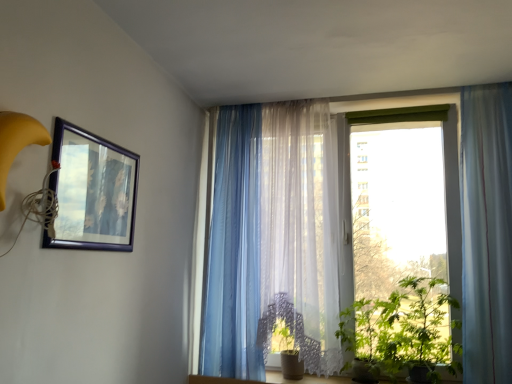
What do you see at coordinates (402, 330) in the screenshot?
I see `green leafy plant at right` at bounding box center [402, 330].

Describe the element at coordinates (279, 239) in the screenshot. I see `translucent fabric curtain at center, the second curtain viewed from the right` at that location.

What is the approximate width of matte black picture frame at upper left?

matte black picture frame at upper left is 2.11 inches in width.

You are a GUI agent. You are given a task and a screenshot of the screen. Output one action in this format:
    pyautogui.click(x=<x>, y=<y>)
    Task: Click on the translucent blue curtain at center, arranged as the third curtain when viewed from the right
    The height and width of the screenshot is (384, 512).
    Given the screenshot: What is the action you would take?
    pyautogui.click(x=234, y=250)

Considering the positions of point (245, 123) and point (376, 324), is point (245, 123) closer or farther from the camera than point (376, 324)?

Point (245, 123).

In terms of size, does translucent blue curtain at center, which is counted as the 1th curtain, starting from the left, appear bigger or smaller than green leafy plant at right?

In the image, translucent blue curtain at center, which is counted as the 1th curtain, starting from the left, appears to be larger than green leafy plant at right.

Is translucent blue curtain at center, arranged as the third curtain when viewed from the right, not close to green leafy plant at right?

translucent blue curtain at center, arranged as the third curtain when viewed from the right, is actually quite close to green leafy plant at right.

From a real-world perspective, between translucent blue curtain at center, arranged as the third curtain when viewed from the right, and green leafy plant at right, who is vertically lower?

In real-world perspective, green leafy plant at right is lower.

Is translucent fabric curtain at center, the second curtain viewed from the right, aimed at translucent fabric at center?

Yes, translucent fabric curtain at center, the second curtain viewed from the right, is aimed at translucent fabric at center.

In the scene shown: Does translucent fabric curtain at center, the second curtain when ordered from left to right, contain translucent fabric at center?

Definitely not — translucent fabric at center is not inside translucent fabric curtain at center, the second curtain when ordered from left to right.

Is translucent fabric curtain at center, the second curtain viewed from the right, touching translucent fabric at center?

translucent fabric curtain at center, the second curtain viewed from the right, and translucent fabric at center are clearly separated.

Does translucent fabric curtain at center, the second curtain viewed from the right, come behind translucent fabric at center?

That is True.

From a real-world perspective, is green leafy plant at right on translucent fabric at center?

No, from a real-world perspective, green leafy plant at right is not above translucent fabric at center.

From the image's perspective, is green leafy plant at right located above or below translucent fabric at center?

Based on their image positions, green leafy plant at right is located beneath translucent fabric at center.

Is point (391, 373) positioned before point (497, 333)?

No, it is not.

Does green leafy plant at right have a greater width compared to translucent fabric at center?

Correct, the width of green leafy plant at right exceeds that of translucent fabric at center.

Does translucent fabric at center have a lesser width compared to translucent blue curtain at right, the 1th curtain in the right-to-left sequence?

No.

Is translucent fabric at center at the right side of translucent blue curtain at right, the 1th curtain in the right-to-left sequence?

No, translucent fabric at center is not to the right of translucent blue curtain at right, the 1th curtain in the right-to-left sequence.

From a real-world perspective, is translucent fabric at center located higher than translucent blue curtain at right, the 1th curtain in the right-to-left sequence?

Incorrect, from a real-world perspective, translucent fabric at center is lower than translucent blue curtain at right, the 1th curtain in the right-to-left sequence.

How different are the orientations of translucent fabric at center and translucent blue curtain at right, the 1th curtain in the right-to-left sequence, in degrees?

The facing directions of translucent fabric at center and translucent blue curtain at right, the 1th curtain in the right-to-left sequence, are 0.13 degrees apart.

From the image's perspective, is green leafy plant at right located beneath green leafy plant at lower right?

Incorrect, from the image's perspective, green leafy plant at right is higher than green leafy plant at lower right.

Is point (394, 356) closer or farther from the camera than point (341, 342)?

Point (394, 356) is positioned closer to the camera compared to point (341, 342).

Looking at the image, does green leafy plant at right seem bigger or smaller compared to green leafy plant at lower right?

In the image, green leafy plant at right appears to be larger than green leafy plant at lower right.

Between translucent fabric at center and translucent fabric curtain at center, the second curtain when ordered from left to right, which one has more height?

With more height is translucent fabric curtain at center, the second curtain when ordered from left to right.

From a real-world perspective, is translucent fabric at center positioned above or below translucent fabric curtain at center, the second curtain when ordered from left to right?

From a real-world perspective, translucent fabric at center is physically below translucent fabric curtain at center, the second curtain when ordered from left to right.

Is translucent fabric at center aimed at translucent fabric curtain at center, the second curtain when ordered from left to right?

Yes, translucent fabric at center is facing translucent fabric curtain at center, the second curtain when ordered from left to right.

Between translucent fabric at center and translucent fabric curtain at center, the second curtain viewed from the right, which one appears on the right side from the viewer's perspective?

translucent fabric at center.

Is translucent fabric at center bigger or smaller than green leafy plant at lower right?

Clearly, translucent fabric at center is larger in size than green leafy plant at lower right.

Which of these two, translucent fabric at center or green leafy plant at lower right, stands shorter?

Standing shorter between the two is green leafy plant at lower right.

Is there a large distance between translucent fabric at center and green leafy plant at lower right?

Actually, translucent fabric at center and green leafy plant at lower right are a little close together.

Measure the distance between translucent fabric at center and green leafy plant at lower right.

They are 16.18 inches apart.

From the green leafy plant at right, count 2nd curtains backward and point to it. Please provide its 2D coordinates.

[(234, 250)]

Locate an element on the screen. This screenshot has width=512, height=384. the 2nd curtain above when counting from the translucent fabric at center (from the image's perspective) is located at coordinates (279, 239).

Which object lies nearer to the anchor point translucent blue curtain at center, which is counted as the 1th curtain, starting from the left, matte black picture frame at upper left or translucent fabric at center?

translucent fabric at center lies closer to translucent blue curtain at center, which is counted as the 1th curtain, starting from the left, than the other object.

Estimate the real-world distances between objects in this image. Which object is closer to translucent blue curtain at right, the 1th curtain in the right-to-left sequence, translucent fabric curtain at center, the second curtain when ordered from left to right, or green leafy plant at right?

green leafy plant at right.

Consider the image. Considering their positions, is translucent fabric at center positioned further to green leafy plant at right than matte black picture frame at upper left?

matte black picture frame at upper left is further to green leafy plant at right.

Which object lies nearer to the anchor point translucent fabric at center, green leafy plant at right or matte black picture frame at upper left?

Among the two, green leafy plant at right is located nearer to translucent fabric at center.

When comparing their distances from translucent blue curtain at right, the third curtain when ordered from left to right, does green leafy plant at right or translucent blue curtain at center, which is counted as the 1th curtain, starting from the left, seem further?

translucent blue curtain at center, which is counted as the 1th curtain, starting from the left, lies further to translucent blue curtain at right, the third curtain when ordered from left to right, than the other object.

When comparing their distances from green leafy plant at right, does translucent blue curtain at center, which is counted as the 1th curtain, starting from the left, or translucent fabric at center seem further?

translucent blue curtain at center, which is counted as the 1th curtain, starting from the left, is positioned further to the anchor green leafy plant at right.

Based on their spatial positions, is translucent fabric curtain at center, the second curtain when ordered from left to right, or translucent blue curtain at center, which is counted as the 1th curtain, starting from the left, further from green leafy plant at right?

Among the two, translucent blue curtain at center, which is counted as the 1th curtain, starting from the left, is located further to green leafy plant at right.

From the image, which object appears to be farther from translucent blue curtain at right, the third curtain when ordered from left to right, green leafy plant at right or translucent fabric at center?

green leafy plant at right is positioned further to the anchor translucent blue curtain at right, the third curtain when ordered from left to right.

The image size is (512, 384). What are the coordinates of `curtain situated between translucent blue curtain at center, arranged as the third curtain when viewed from the right, and green leafy plant at lower right from left to right` in the screenshot? It's located at tap(279, 239).

Where is `window situated between translucent blue curtain at center, which is counted as the 1th curtain, starting from the left, and green leafy plant at lower right from left to right`? window situated between translucent blue curtain at center, which is counted as the 1th curtain, starting from the left, and green leafy plant at lower right from left to right is located at coordinates (472, 212).

This screenshot has height=384, width=512. In order to click on curtain located between translucent blue curtain at center, which is counted as the 1th curtain, starting from the left, and translucent fabric at center in the left-right direction in this screenshot , I will do `click(279, 239)`.

This screenshot has width=512, height=384. I want to click on window between matte black picture frame at upper left and green leafy plant at lower right in the horizontal direction, so click(472, 212).